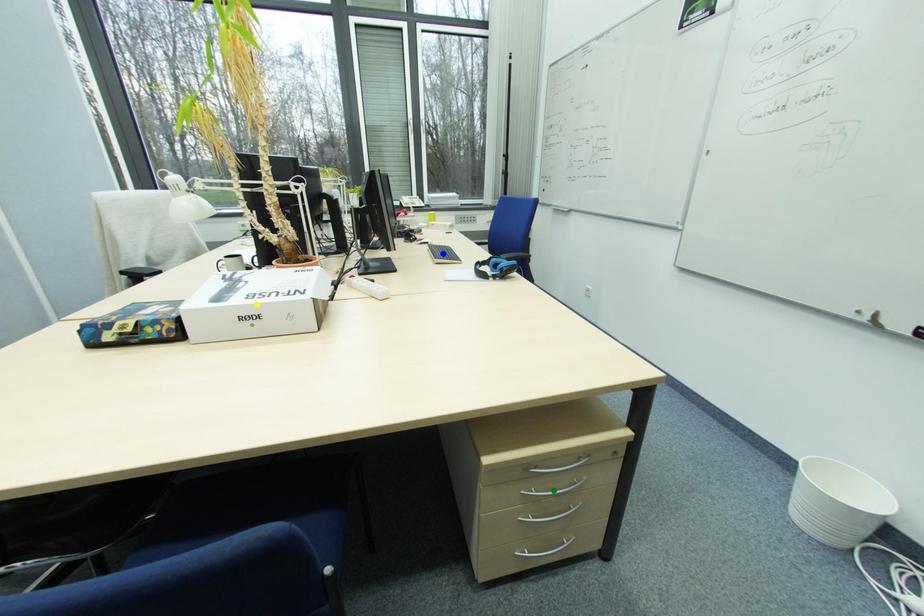
Order these from nearest to farthest:
A) green point
B) yellow point
C) blue point

blue point → yellow point → green point